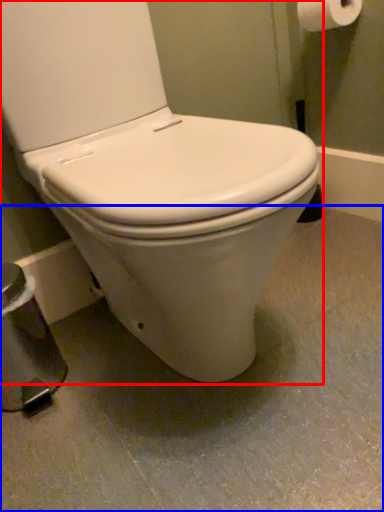
Question: Which object is closer to the camera taking this photo, toilet (highlighted by a red box) or concrete (highlighted by a blue box)?

Choices:
 (A) toilet
 (B) concrete

Answer: (A)